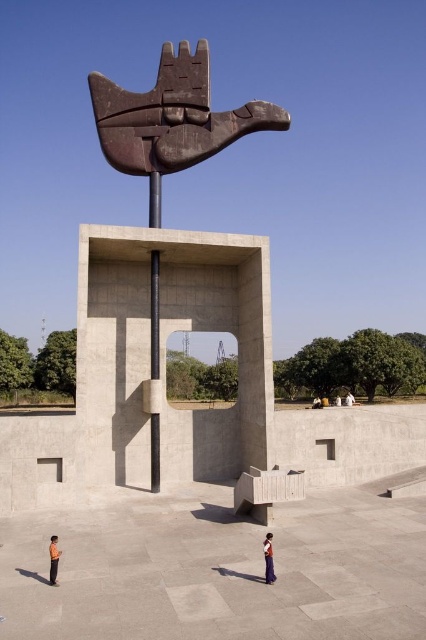
Looking at this image, you are planning to sit on the light brown wooden bench at center. There is a dark brown leather jacket at center nearby. Can you place the jacket on the bench without it hanging off the sides?

The light brown wooden bench at center might be wider than dark brown leather jacket at center, so there is a possibility that the jacket can be placed on the bench without overhanging. However, the exact dimensions are uncertain based on the given information.

You are standing at the entrance of the plaza and want to place a new bench exactly at the center of the orange fabric pants at center. Where should you place the bench?

The orange fabric pants at center is located at point (268, 557), so the bench should be placed at that coordinate.